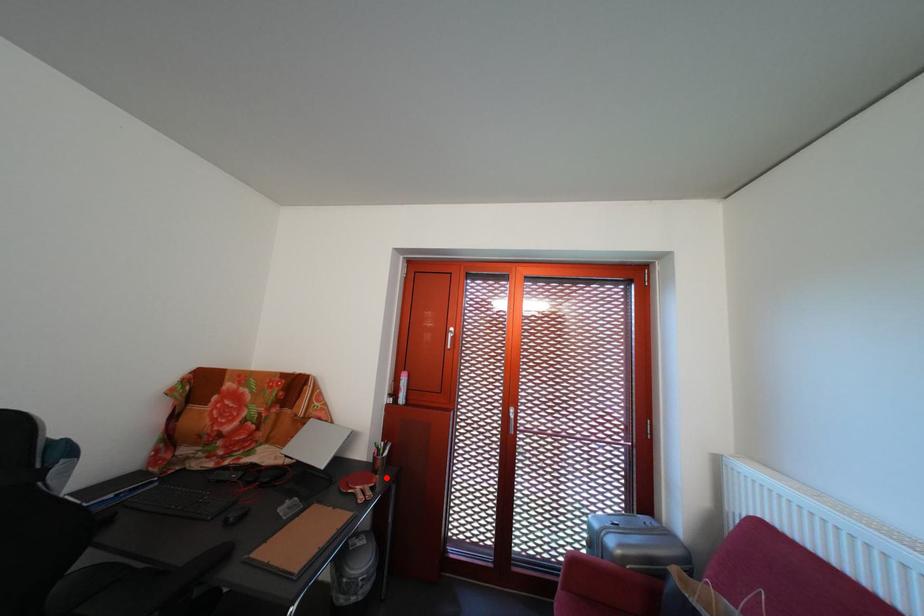
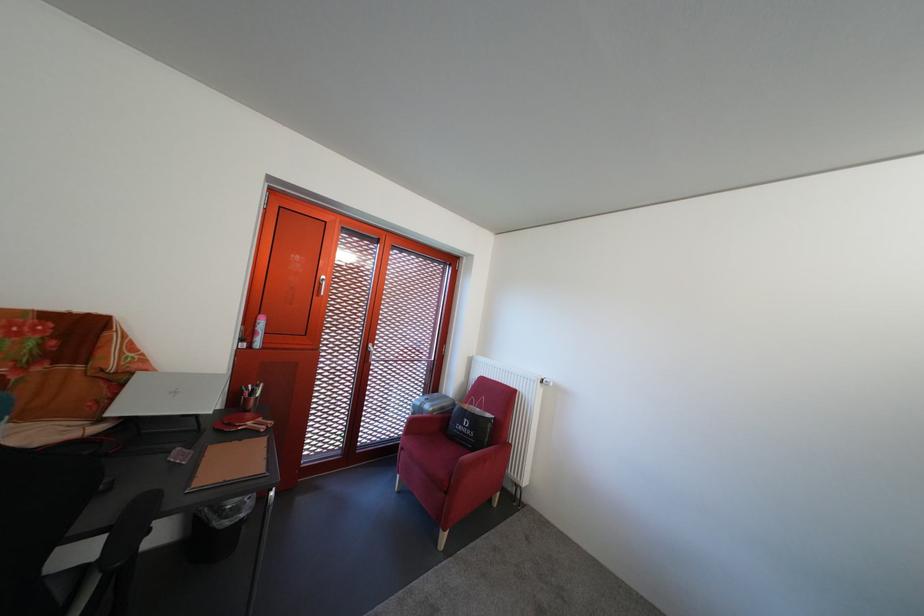
Question: I am providing you with two images of the same scene from different viewpoints. A red point is shown in image1. For the corresponding object point in image2, is it positioned nearer or farther from the camera?

Choices:
 (A) Nearer
 (B) Farther

Answer: (A)